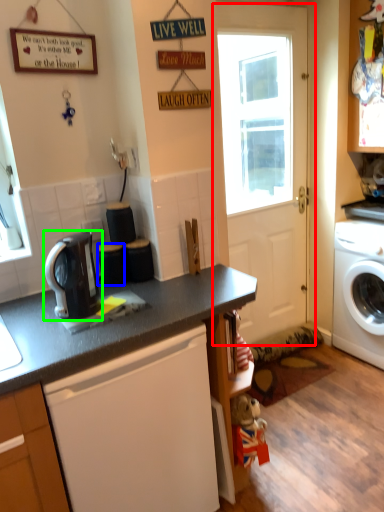
Question: Estimate the real-world distances between objects in this image. Which object is closer to door (highlighted by a red box), appliance (highlighted by a blue box) or kitchen appliance (highlighted by a green box)?

Choices:
 (A) appliance
 (B) kitchen appliance

Answer: (A)